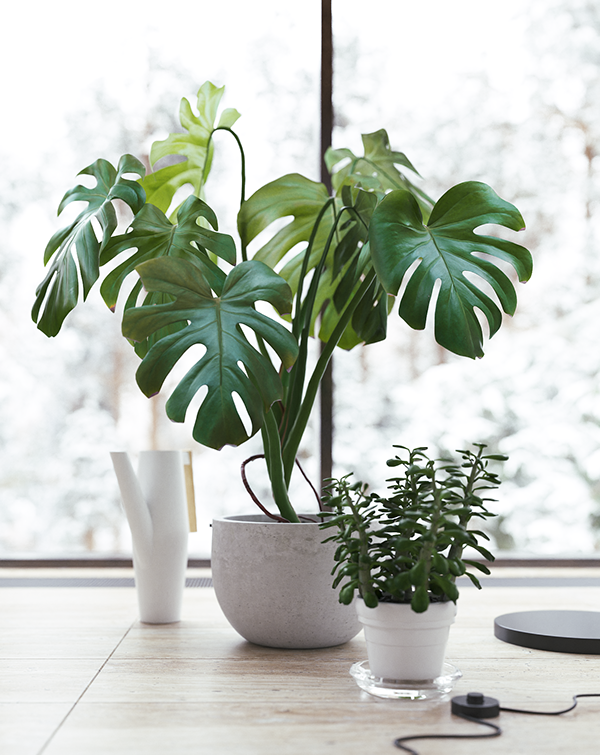
Locate an element on the screen. The height and width of the screenshot is (755, 600). gray plant pot is located at coordinates (268, 550).